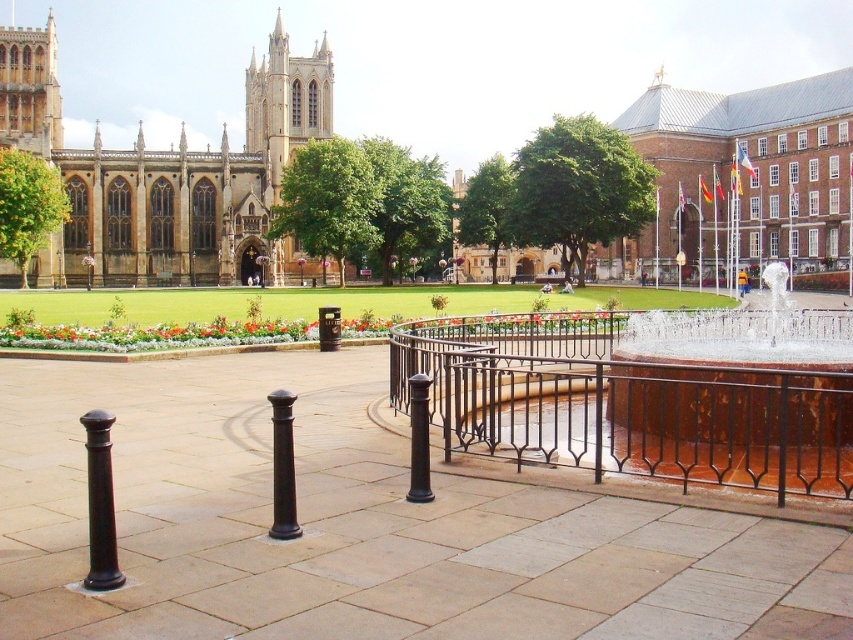
You are standing at the entrance of the cathedral and want to reach the fountain in the square. According to the image, which direction should you move relative to the black wrought iron fence at center?

The black wrought iron fence at center is located at point (624,404), so you should move towards the fountain by going around the fence to the right side since the fence is positioned centrally in your path.

You are standing at the camera position in the urban square and want to walk to the point marked as point [569,346]. How far will you have to walk?

The distance between the camera and point [569,346] is 95.12 meters, so you will have to walk 95.12 meters to reach it.

You are a city planner assessing the urban square. You need to install a new bench that requires a support structure. Given the objects present, which one between the black wrought iron fence at center and the black polished post at center would be more suitable for attaching the bench due to its size?

The black wrought iron fence at center is larger in size than the black polished post at center, so it would be more suitable for attaching the bench as it can provide a sturdier and more stable support structure.